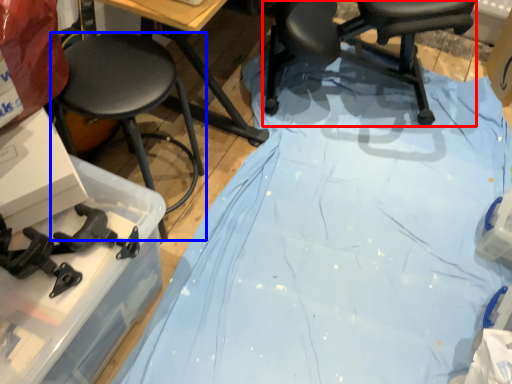
Question: Among these objects, which one is nearest to the camera, chair (highlighted by a red box) or stool (highlighted by a blue box)?

Choices:
 (A) chair
 (B) stool

Answer: (B)